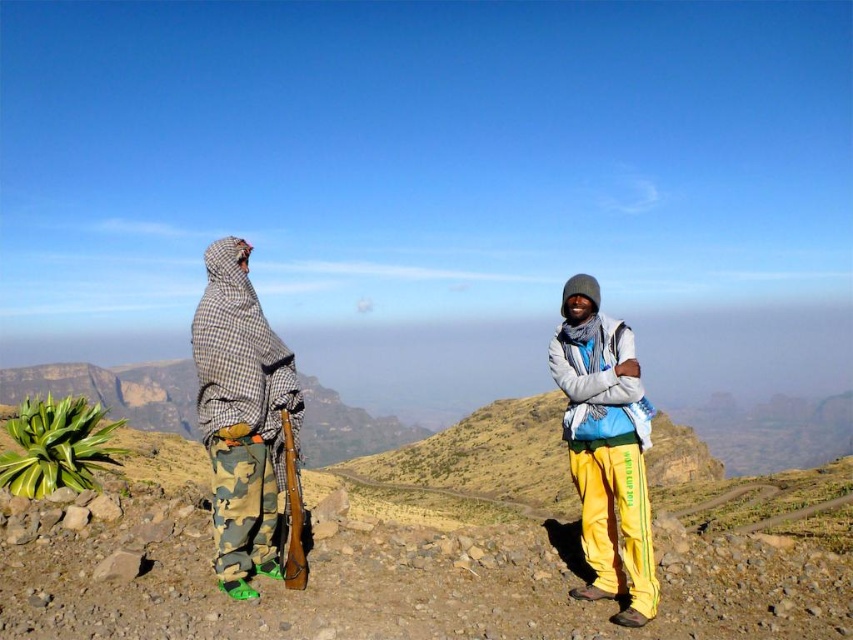
Question: Based on their relative distances, which object is nearer to the yellow fleece pants at right?

Choices:
 (A) camo fabric ski at left
 (B) camouflage pants at left

Answer: (B)

Question: Does camouflage pants at left appear over yellow fleece pants at right?

Choices:
 (A) yes
 (B) no

Answer: (A)

Question: Does camo fabric ski at left have a lesser width compared to yellow fleece pants at right?

Choices:
 (A) no
 (B) yes

Answer: (A)

Question: Which point is farther from the camera taking this photo?

Choices:
 (A) coord(262,390)
 (B) coord(645,586)
 (C) coord(631,420)

Answer: (C)

Question: Can you confirm if camo fabric ski at left is positioned to the right of yellow fleece pants at right?

Choices:
 (A) yes
 (B) no

Answer: (B)

Question: Which object is positioned farthest from the camouflage pants at left?

Choices:
 (A) yellow fleece pants at right
 (B) camo fabric ski at left

Answer: (B)